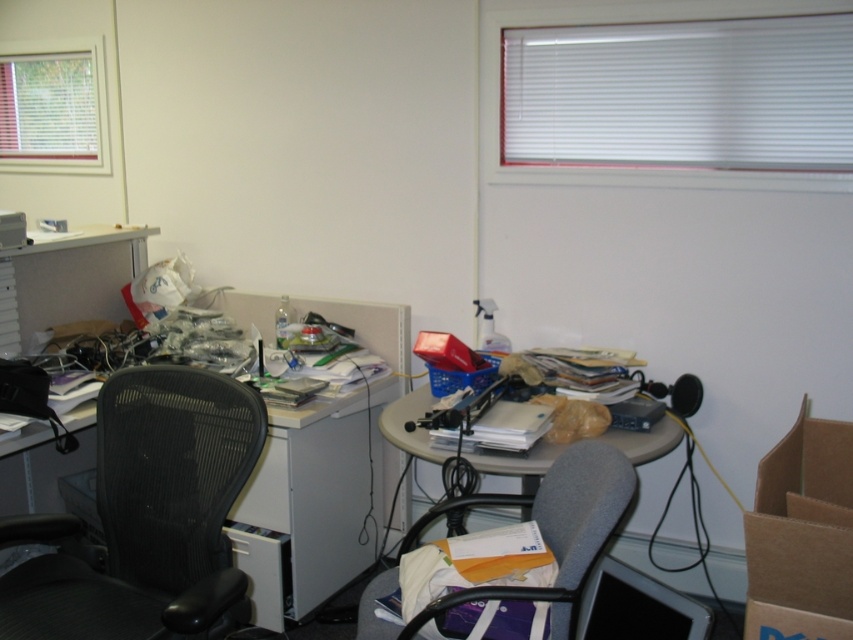
Is brown cardboard box at lower right thinner than gray fabric chair at lower center?

Correct, brown cardboard box at lower right's width is less than gray fabric chair at lower center's.

The width and height of the screenshot is (853, 640). What are the coordinates of `brown cardboard box at lower right` in the screenshot? It's located at (801, 536).

Identify the location of brown cardboard box at lower right. The image size is (853, 640). (801, 536).

Does point (572, 506) come in front of point (653, 628)?

Yes, point (572, 506) is in front of point (653, 628).

Can you confirm if gray fabric chair at lower center is positioned to the right of black plastic monitor at lower center?

Incorrect, gray fabric chair at lower center is not on the right side of black plastic monitor at lower center.

Is point (621, 490) positioned in front of point (648, 637)?

Yes.

Find the location of a particular element. Image resolution: width=853 pixels, height=640 pixels. gray fabric chair at lower center is located at coordinates (541, 532).

From the picture: Is gray fabric chair at lower center smaller than matte plastic table at center?

Indeed, gray fabric chair at lower center has a smaller size compared to matte plastic table at center.

Between point (601, 525) and point (680, 435), which one is positioned in front?

Point (601, 525)

At what (x,y) coordinates should I click in order to perform the action: click on gray fabric chair at lower center. Please return your answer as a coordinate pair (x, y). The width and height of the screenshot is (853, 640). Looking at the image, I should click on (541, 532).